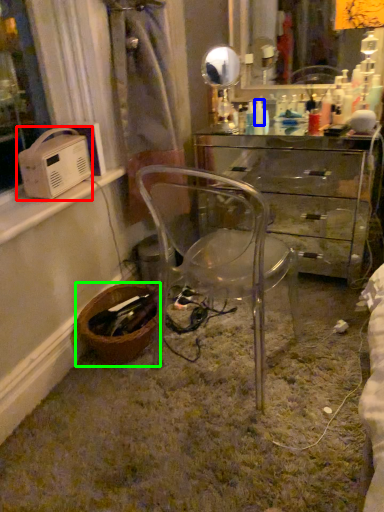
Question: Which is nearer to the appliance (highlighted by a red box)? toiletry (highlighted by a blue box) or basket (highlighted by a green box).

Choices:
 (A) toiletry
 (B) basket

Answer: (B)